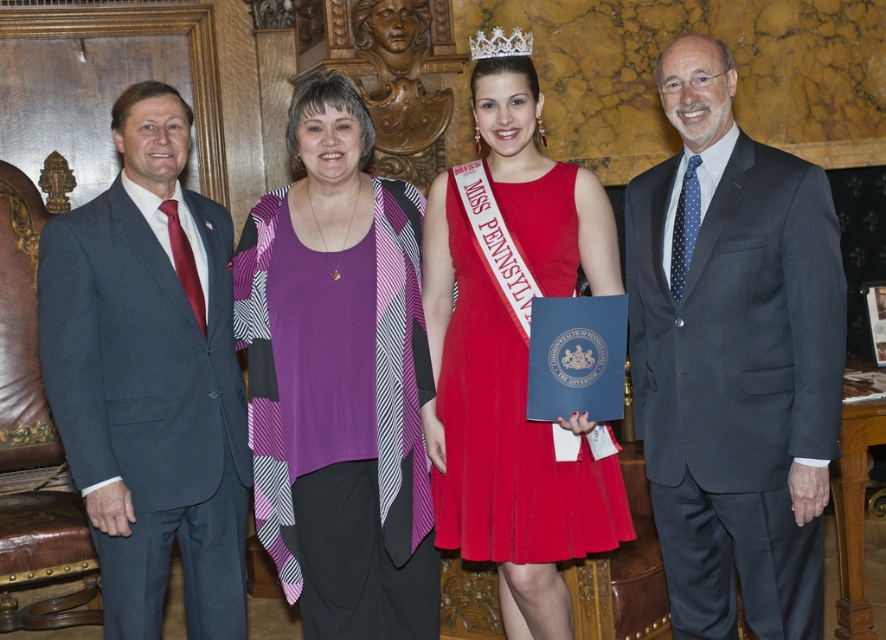
Question: Does dark gray suit at right have a lesser width compared to red satin dress at center?

Choices:
 (A) yes
 (B) no

Answer: (A)

Question: Which of the following is the farthest from the observer?

Choices:
 (A) (782, 321)
 (B) (392, 452)
 (C) (517, 54)

Answer: (B)

Question: Is purple knit top at center thinner than dark blue suit at left?

Choices:
 (A) no
 (B) yes

Answer: (A)

Question: Estimate the real-world distances between objects in this image. Which object is closer to the silver metallic tiara at upper center?

Choices:
 (A) dark gray suit at right
 (B) dark blue suit at left
 (C) red satin dress at center
 (D) purple knit top at center

Answer: (C)

Question: Is dark gray suit at right below dark blue suit at left?

Choices:
 (A) yes
 (B) no

Answer: (B)

Question: Which point is closer to the camera taking this photo?

Choices:
 (A) (483, 488)
 (B) (400, 548)
 (C) (472, 44)
 (D) (126, 280)

Answer: (A)